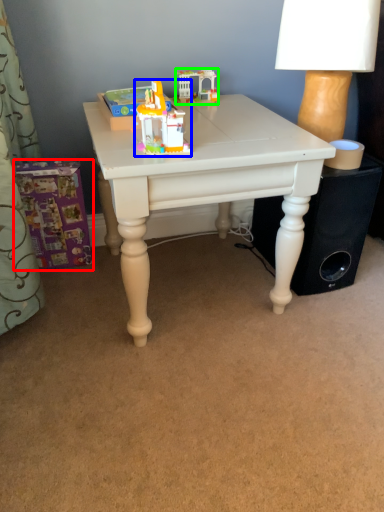
Question: Which object is the farthest from toy (highlighted by a red box)? Choose among these: toy (highlighted by a blue box) or toy (highlighted by a green box).

Choices:
 (A) toy
 (B) toy

Answer: (B)